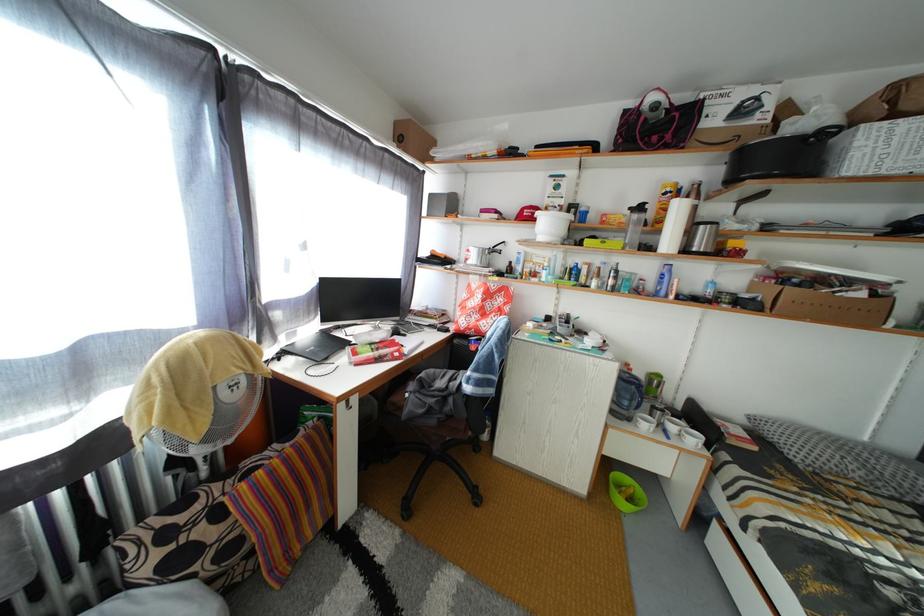
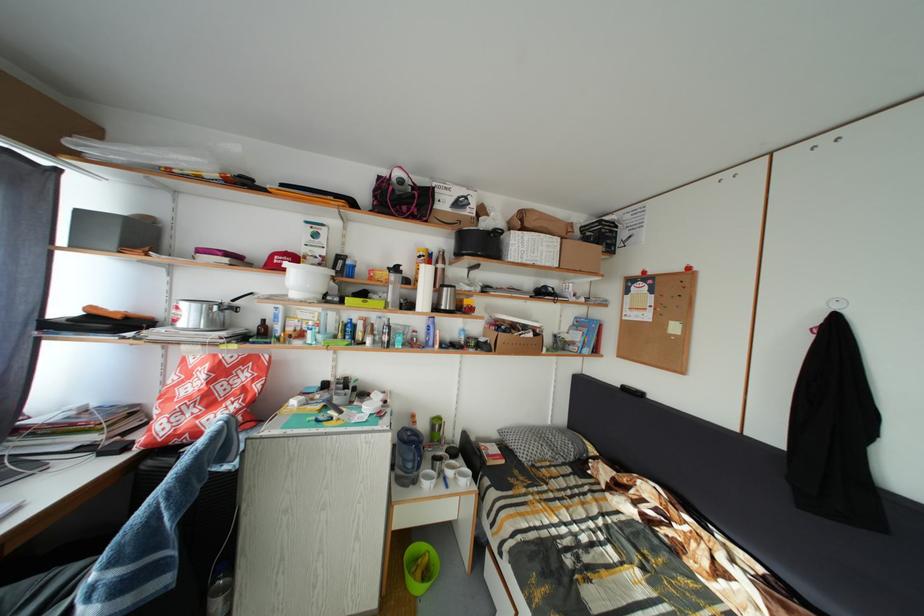
Question: I am providing you with two images of the same scene from different viewpoints. After the viewpoint changes to image2, which objects are now occluded?

Choices:
 (A) white mug
 (B) silver pot handle
 (C) cardboard box
 (D) none of these

Answer: (D)